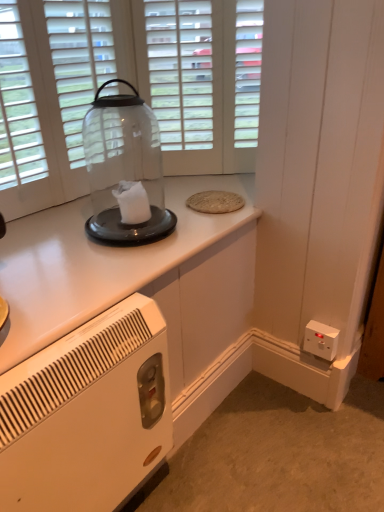
Question: Looking at their shapes, would you say transparent glass jar at center is wider or thinner than white plastic electrical outlet at lower right?

Choices:
 (A) wide
 (B) thin

Answer: (A)

Question: Relative to white plastic electrical outlet at lower right, is transparent glass jar at center in front or behind?

Choices:
 (A) front
 (B) behind

Answer: (A)

Question: Which is farther from the white glossy cabinet at upper center?

Choices:
 (A) transparent glass door at upper center
 (B) white plastic heater at lower left
 (C) transparent glass jar at center
 (D) white plastic electrical outlet at lower right

Answer: (D)

Question: Which object is the farthest from the white plastic electrical outlet at lower right?

Choices:
 (A) white glossy cabinet at upper center
 (B) transparent glass jar at center
 (C) white plastic heater at lower left
 (D) transparent glass door at upper center

Answer: (D)